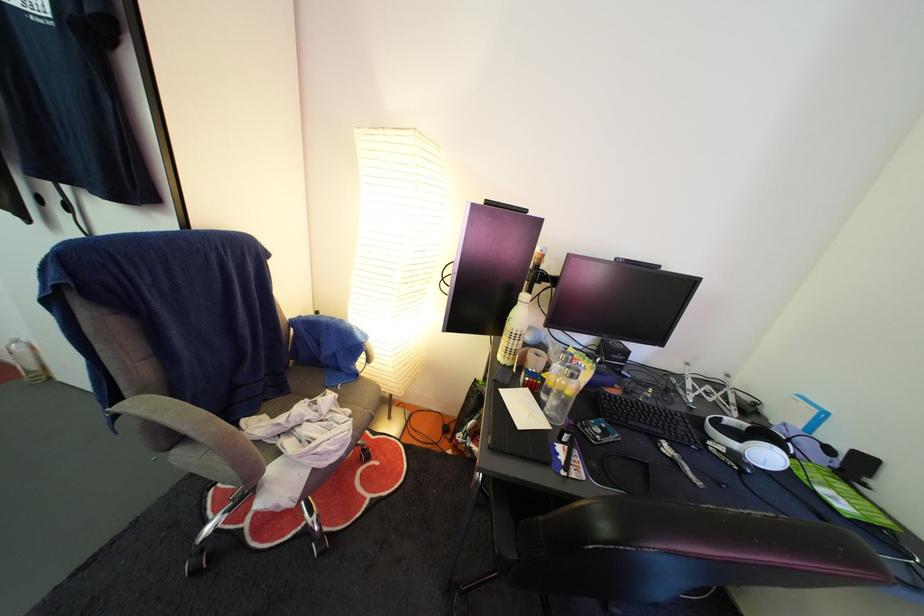
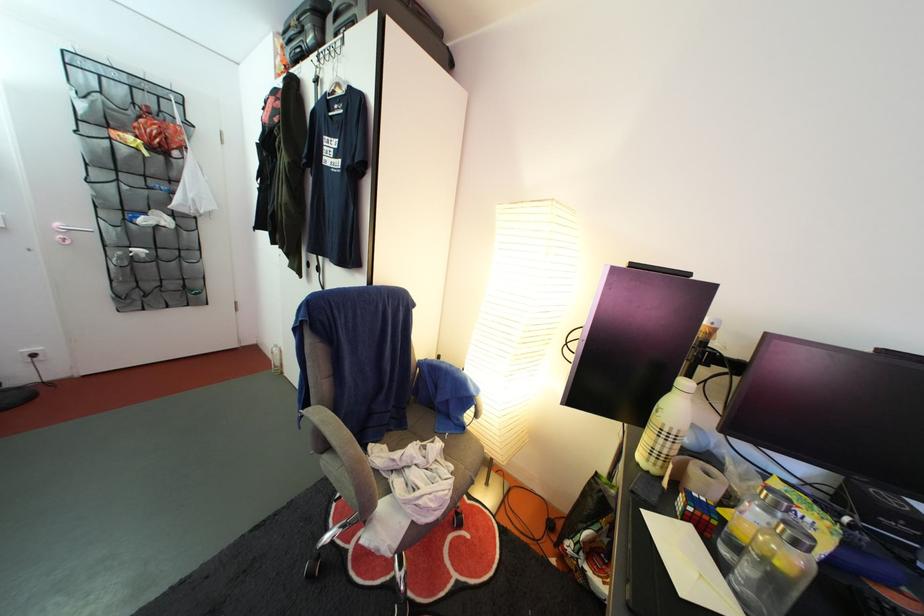
Question: The images are taken continuously from a first-person perspective. In which direction are you moving?

Choices:
 (A) Left
 (B) Right
 (C) Forward
 (D) Backward

Answer: (A)